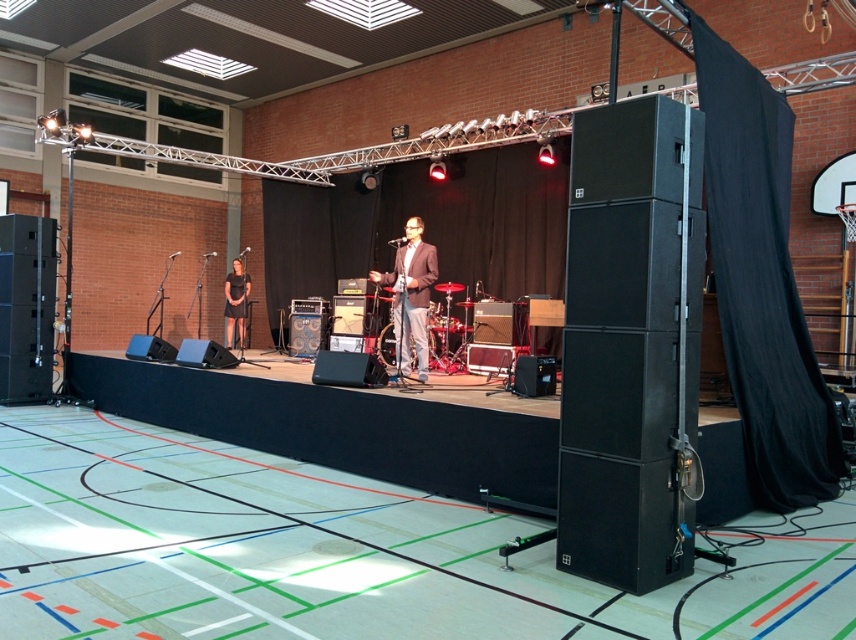
Is matte black suit at center to the right of dark gray dress at stage left from the viewer's perspective?

Indeed, matte black suit at center is positioned on the right side of dark gray dress at stage left.

Locate an element on the screen. This screenshot has height=640, width=856. matte black suit at center is located at coordinates (409, 296).